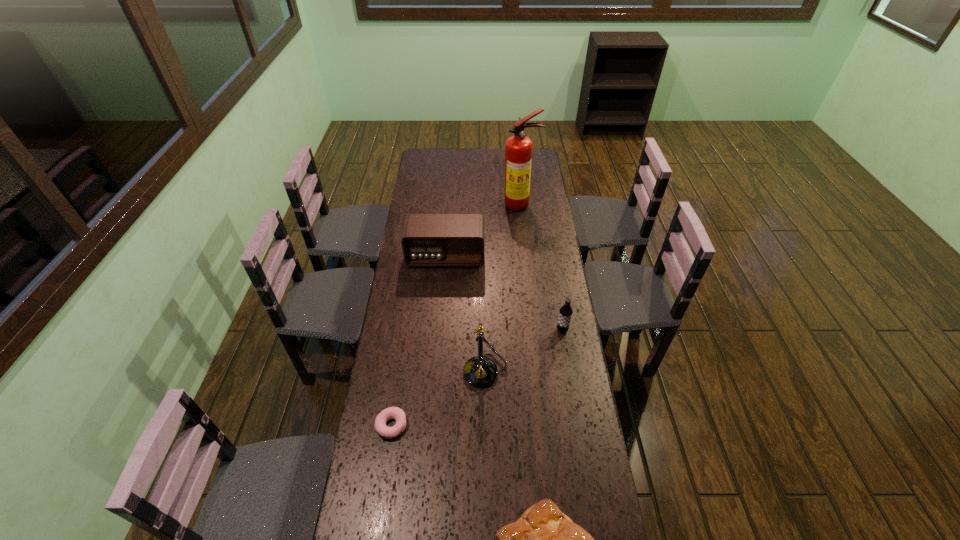
The image size is (960, 540). In order to click on free spot at the right edge of the desktop in this screenshot , I will do `click(574, 350)`.

At what (x,y) coordinates should I click in order to perform the action: click on free area in between the fourth farthest object and the radio receiver. Please return your answer as a coordinate pair (x, y). The image size is (960, 540). Looking at the image, I should click on (466, 314).

I want to click on vacant space that's between the radio receiver and the shortest object, so click(x=419, y=341).

Find the location of a particular element. This screenshot has width=960, height=540. free space between the second farthest object and the shortest object is located at coordinates (419, 341).

Where is `vacant space in between the telephone and the fourth nearest object`? The height and width of the screenshot is (540, 960). vacant space in between the telephone and the fourth nearest object is located at coordinates (524, 350).

This screenshot has height=540, width=960. What are the coordinates of `vacant space that's between the fourth farthest object and the fourth nearest object` in the screenshot? It's located at (524, 350).

Where is `empty space between the second nearest object and the telephone`? empty space between the second nearest object and the telephone is located at coordinates (439, 398).

The width and height of the screenshot is (960, 540). I want to click on the closest object relative to the telephone, so click(396, 413).

You are a GUI agent. You are given a task and a screenshot of the screen. Output one action in this format:
    pyautogui.click(x=<x>, y=<y>)
    Task: Click on the third closest object to the fourth nearest object
    The height and width of the screenshot is (540, 960).
    Given the screenshot: What is the action you would take?
    (544, 539)

This screenshot has width=960, height=540. What are the coordinates of `free space that satisfies the following two spatial constraints: 1. on the front-facing side of the root beer; 2. on the left side of the farthest object` in the screenshot? It's located at (534, 330).